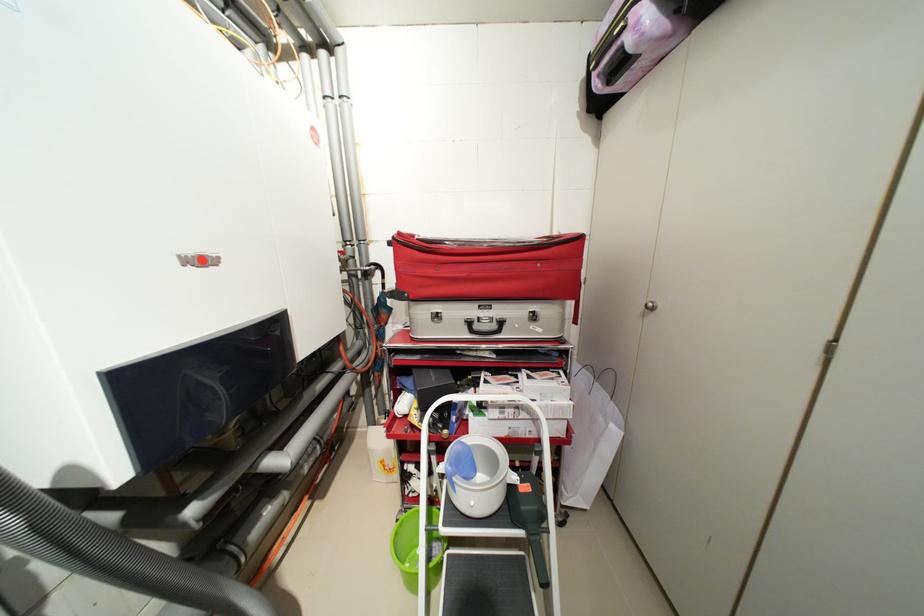
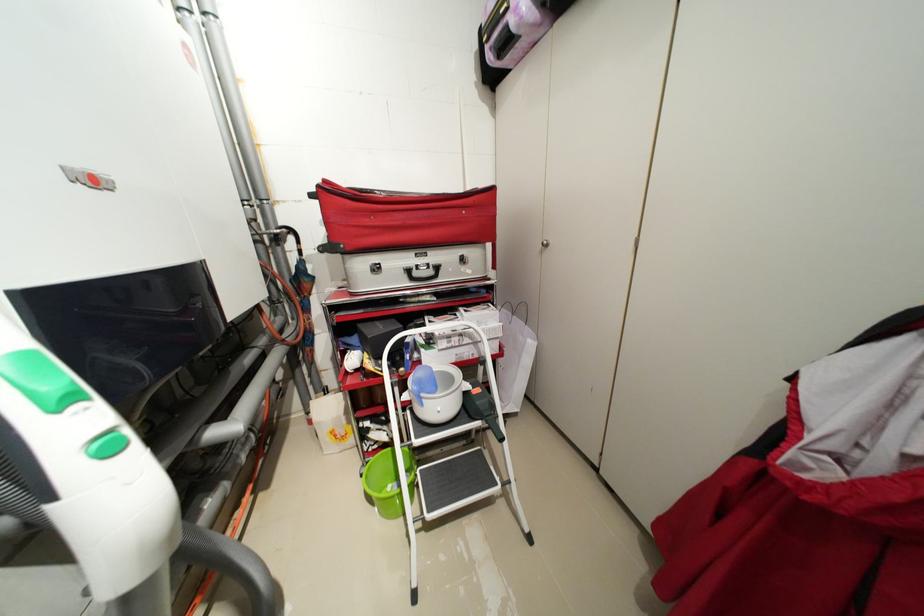
The point at (459, 485) is marked in the first image. Where is the corresponding point in the second image?

(428, 400)